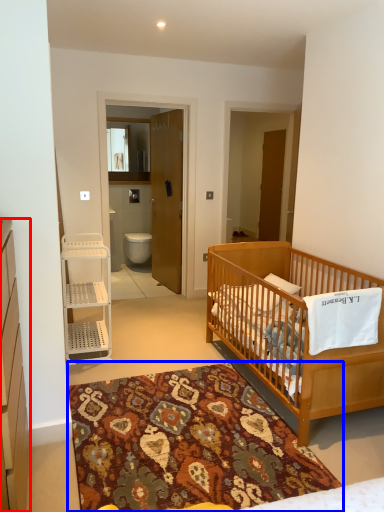
Question: Which point is further to the camera, cabinetry (highlighted by a red box) or mat (highlighted by a blue box)?

Choices:
 (A) cabinetry
 (B) mat

Answer: (B)